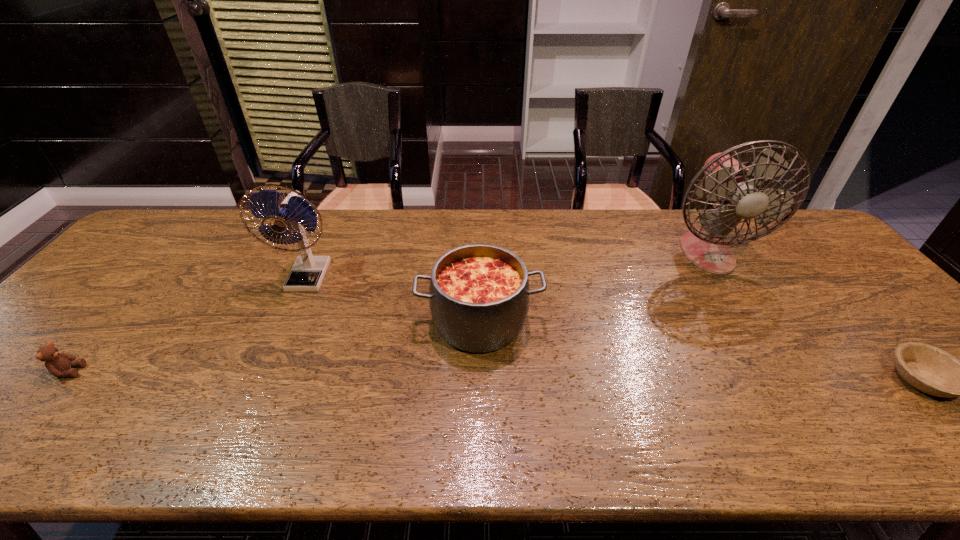
Where is `the tallest object`? The image size is (960, 540). the tallest object is located at coordinates (728, 182).

I want to click on the taller fan, so click(x=728, y=182).

What are the coordinates of `the left fan` in the screenshot? It's located at (296, 213).

The height and width of the screenshot is (540, 960). I want to click on the second tallest object, so click(x=296, y=213).

Locate an element on the screen. Image resolution: width=960 pixels, height=540 pixels. casserole is located at coordinates (479, 296).

You are a GUI agent. You are given a task and a screenshot of the screen. Output one action in this format:
    pyautogui.click(x=<x>, y=<y>)
    Task: Click on the third object from left to right
    
    Given the screenshot: What is the action you would take?
    pyautogui.click(x=479, y=296)

Identify the location of the fourth tallest object. (58, 364).

Where is `teddy bear`? This screenshot has width=960, height=540. teddy bear is located at coordinates (58, 364).

Where is `vacant space located 0.350m in front of the tallest object to direct airflow`? vacant space located 0.350m in front of the tallest object to direct airflow is located at coordinates (786, 378).

Where is `free space located on the front-facing side of the fourth shortest object`? This screenshot has height=540, width=960. free space located on the front-facing side of the fourth shortest object is located at coordinates (258, 388).